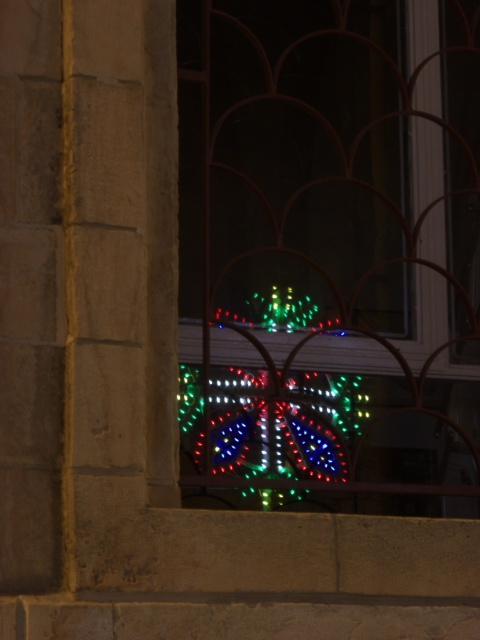
Does led lights at center appear on the left side of illuminated plastic lights at center?

No, led lights at center is not to the left of illuminated plastic lights at center.

Does led lights at center have a smaller size compared to illuminated plastic lights at center?

Actually, led lights at center might be larger than illuminated plastic lights at center.

I want to click on led lights at center, so click(x=328, y=252).

Where is `led lights at center`? led lights at center is located at coordinates (328, 252).